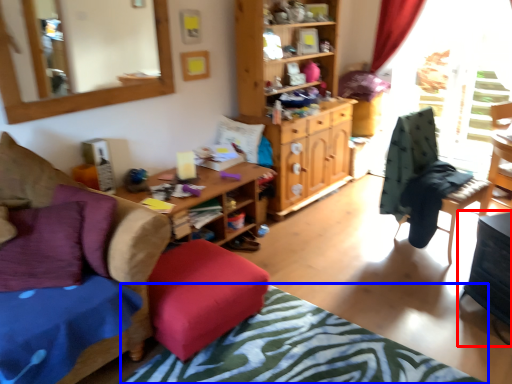
Question: Which of the following is the farthest to the observer, table (highlighted by a red box) or bedcover (highlighted by a blue box)?

Choices:
 (A) table
 (B) bedcover

Answer: (A)